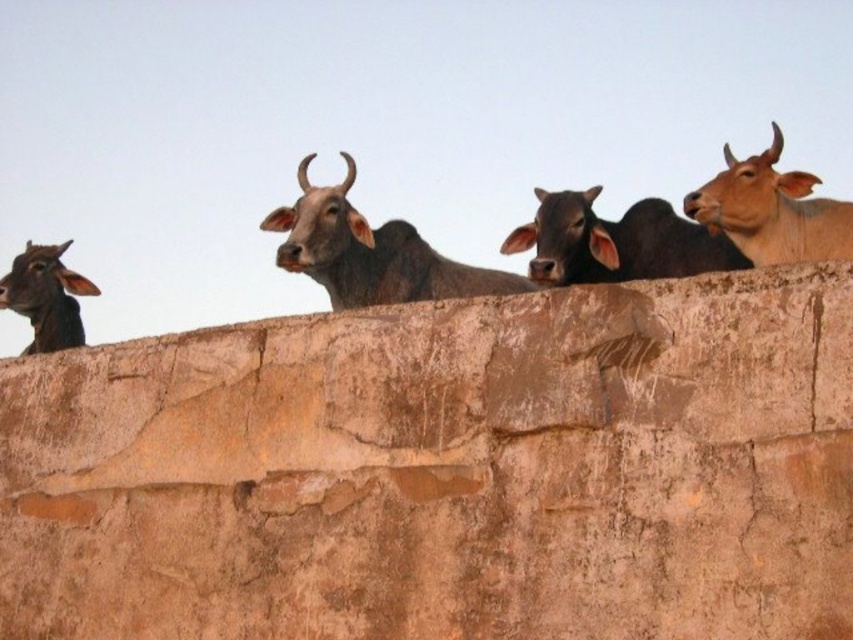
You are a farmer assessing the height of the cows on the stone wall. Which cow is taller between the brown matte cow at center and the light brown smooth cow at upper right?

The light brown smooth cow at upper right is taller than the brown matte cow at center.

You are a farmer who wants to identify the larger animal between the shiny brown bull at center and the brown matte cow at center. Which one is bigger?

The shiny brown bull at center is bigger than the brown matte cow at center.

You are standing at the point labeled point (445,472) on the image. What is the material of the ground beneath your feet?

The point (445,472) is on brown rough stone at center, so the material of the ground beneath your feet is brown rough stone.